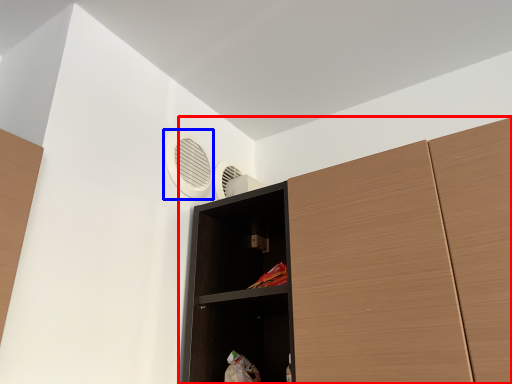
Question: Among these objects, which one is farthest to the camera, cupboard (highlighted by a red box) or air conditioning (highlighted by a blue box)?

Choices:
 (A) cupboard
 (B) air conditioning

Answer: (B)